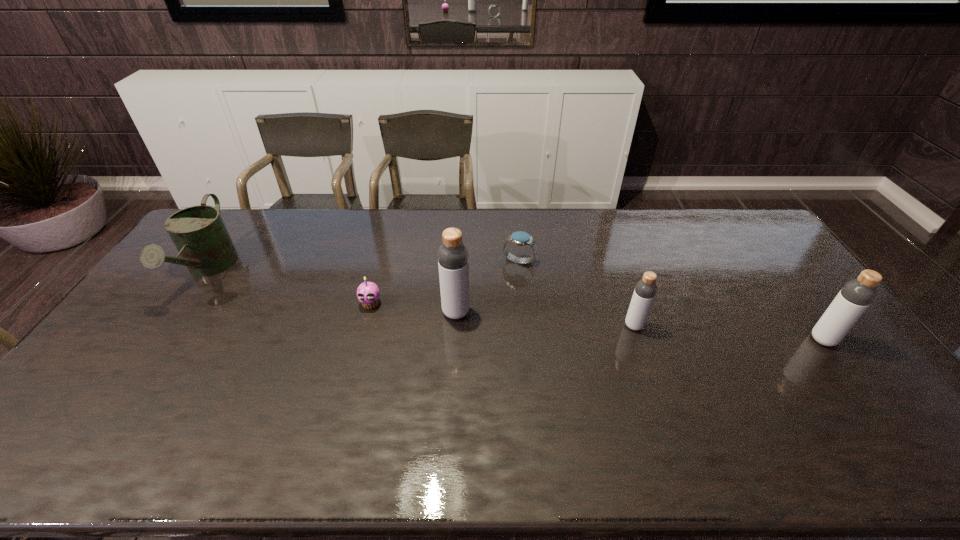
At what (x,y) coordinates should I click in order to perform the action: click on free spot between the second object from left to right and the tallest object. Please return your answer as a coordinate pair (x, y). Looking at the image, I should click on (414, 308).

Where is `vacant space in between the shortest bottle and the second object from left to right`? vacant space in between the shortest bottle and the second object from left to right is located at coordinates (502, 315).

Identify the location of object that stands as the fifth closest to the second tallest bottle. This screenshot has height=540, width=960. (198, 232).

In order to click on object that is the fourth closest to the cupcake in this screenshot , I will do `click(646, 288)`.

Point out which bottle is positioned as the nearest to the cupcake. Please provide its 2D coordinates. Your answer should be formatted as a tuple, i.e. [(x, y)], where the tuple contains the x and y coordinates of a point satisfying the conditions above.

[(453, 258)]

Identify the location of bottle that is the closest to the fifth object from left to right. (453, 258).

Locate an element on the screen. The width and height of the screenshot is (960, 540). free location that satisfies the following two spatial constraints: 1. on the face of the shortest bottle; 2. on the right side of the cupcake is located at coordinates (365, 326).

You are a GUI agent. You are given a task and a screenshot of the screen. Output one action in this format:
    pyautogui.click(x=<x>, y=<y>)
    Task: Click on the free space that satisfies the following two spatial constraints: 1. on the front side of the fourth object from left to right; 2. on the left side of the second object from right to left
    The image size is (960, 540).
    Given the screenshot: What is the action you would take?
    pyautogui.click(x=525, y=326)

The height and width of the screenshot is (540, 960). Find the location of `free region that satisfies the following two spatial constraints: 1. on the face of the cupcake; 2. on the right side of the second bottle from left to right`. free region that satisfies the following two spatial constraints: 1. on the face of the cupcake; 2. on the right side of the second bottle from left to right is located at coordinates (365, 326).

Identify the location of vacant space that satisfies the following two spatial constraints: 1. on the face of the second object from left to right; 2. on the right side of the shortest bottle. Image resolution: width=960 pixels, height=540 pixels. (365, 326).